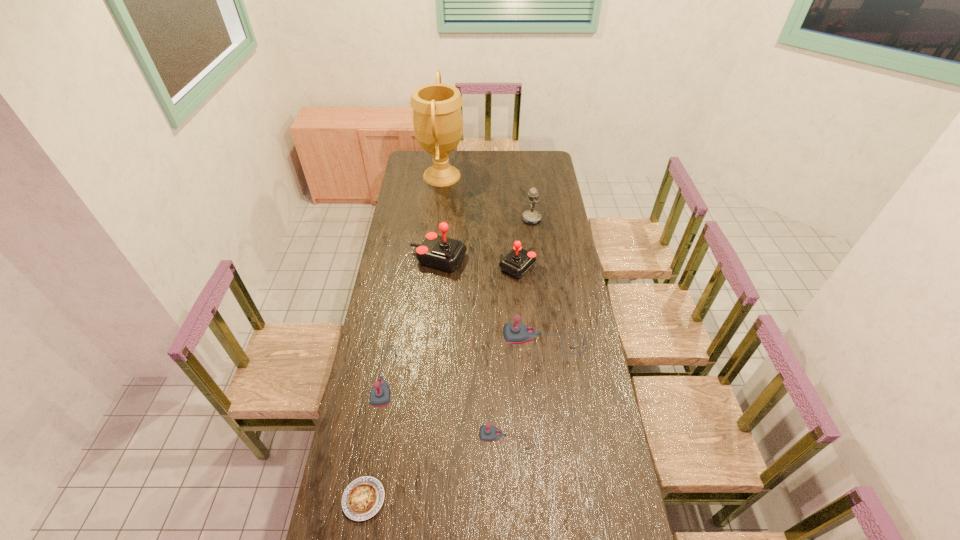
Locate an element on the screen. free point that satisfies the following two spatial constraints: 1. on the engravings side of the farthest object; 2. on the left side of the second tallest joystick is located at coordinates (432, 266).

This screenshot has width=960, height=540. Find the location of `free location that satisfies the following two spatial constraints: 1. on the front side of the seventh tallest object; 2. on the right side of the left red joystick`. free location that satisfies the following two spatial constraints: 1. on the front side of the seventh tallest object; 2. on the right side of the left red joystick is located at coordinates (421, 440).